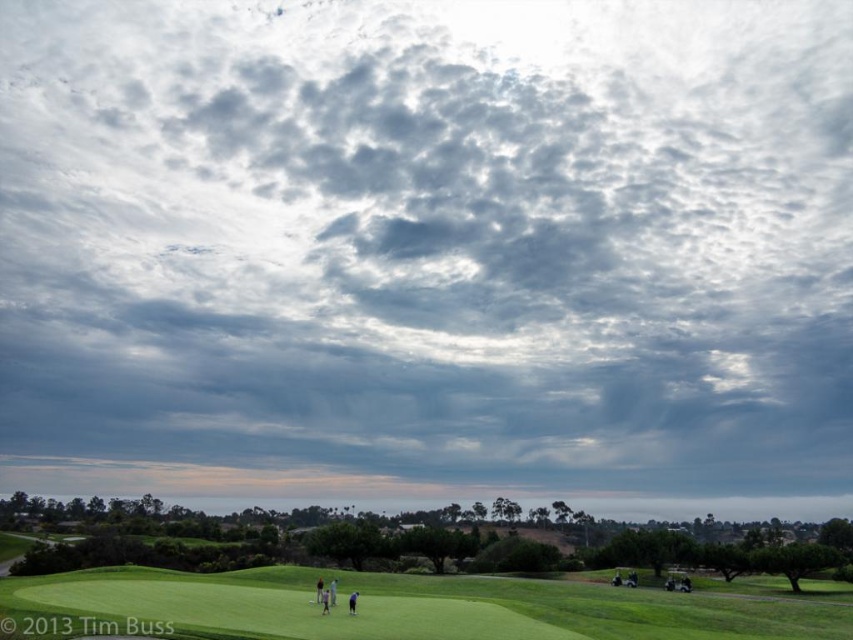
Who is lower down, green grassy field at lower center or dark blue shirt at lower center?

Positioned lower is green grassy field at lower center.

Is point (283, 612) positioned before point (350, 602)?

Yes, it is.

What do you see at coordinates (433, 605) in the screenshot?
I see `green grassy field at lower center` at bounding box center [433, 605].

Where is `green grassy field at lower center`? This screenshot has height=640, width=853. green grassy field at lower center is located at coordinates (433, 605).